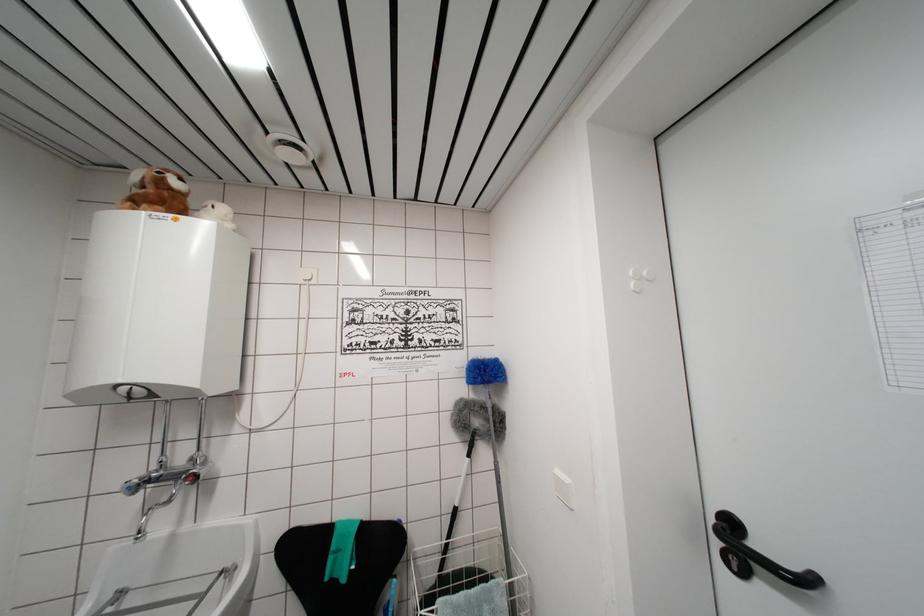
Find where to push the white light switch. Please return your answer as a coordinate pair (x, y).

(308, 276)